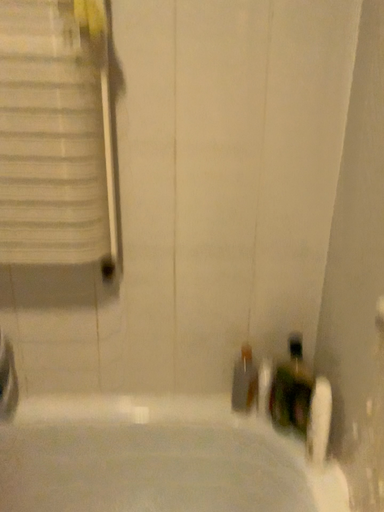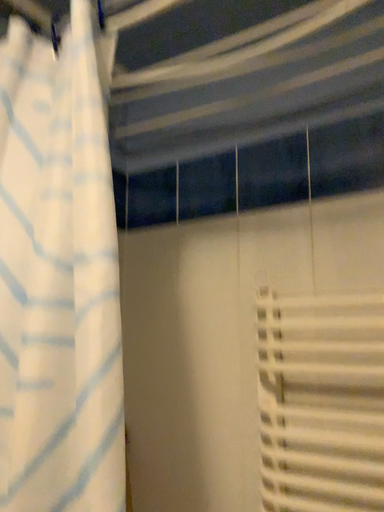
Question: How did the camera likely rotate when shooting the video?

Choices:
 (A) rotated downward
 (B) rotated upward

Answer: (B)